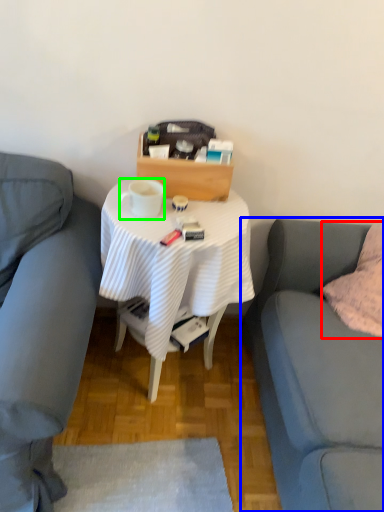
Question: Which object is positioned farthest from pillow (highlighted by a red box)? Select from studio couch (highlighted by a blue box) and coffee cup (highlighted by a green box).

Choices:
 (A) studio couch
 (B) coffee cup

Answer: (B)